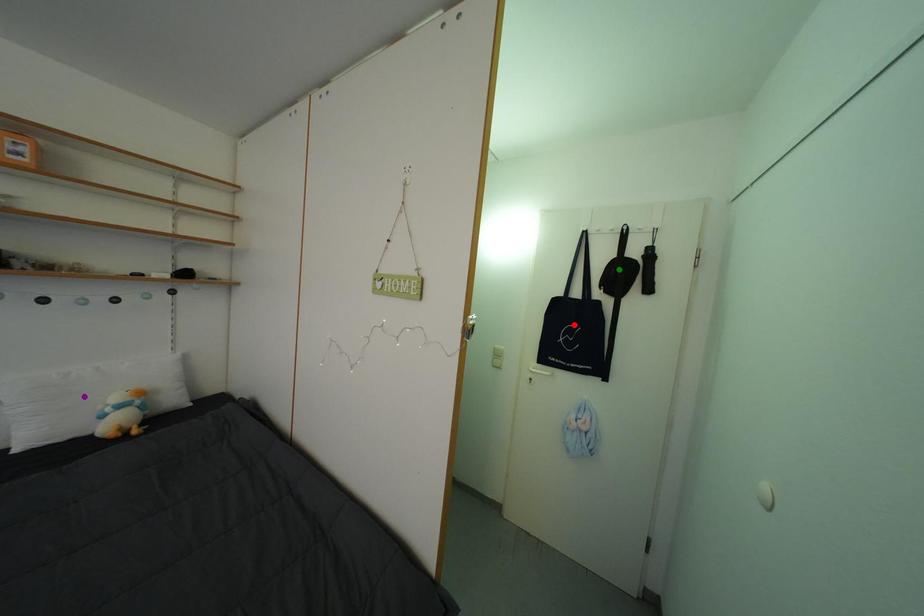
Order these from nearest to farthest:
red point, green point, purple point

purple point, green point, red point